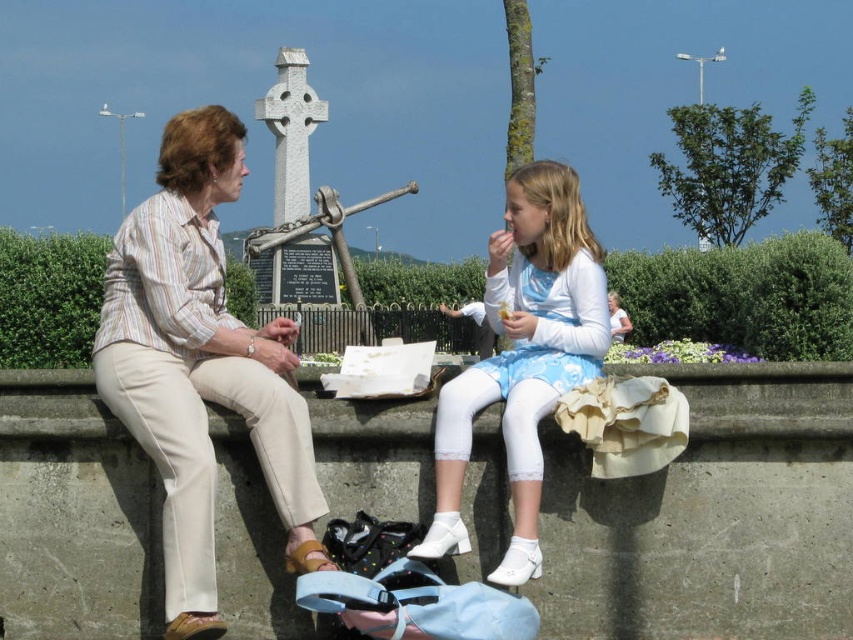
Question: Which object is positioned farthest from the light blue denim dress at center?

Choices:
 (A) beige cotton pants at left
 (B) green leafy hedge at center

Answer: (A)

Question: Which point is farther from the camera taking this photo?

Choices:
 (A) (512, 570)
 (B) (151, 200)

Answer: (B)

Question: In this image, where is beige cotton pants at left located relative to white lace leggings at center?

Choices:
 (A) above
 (B) below

Answer: (B)

Question: Does green leafy hedge at center lie behind light blue denim dress at center?

Choices:
 (A) no
 (B) yes

Answer: (B)

Question: Among these objects, which one is farthest from the camera?

Choices:
 (A) beige cotton pants at left
 (B) green leafy hedge at center

Answer: (B)

Question: Considering the relative positions of green leafy hedge at center and light blue denim dress at center in the image provided, where is green leafy hedge at center located with respect to light blue denim dress at center?

Choices:
 (A) left
 (B) right

Answer: (A)